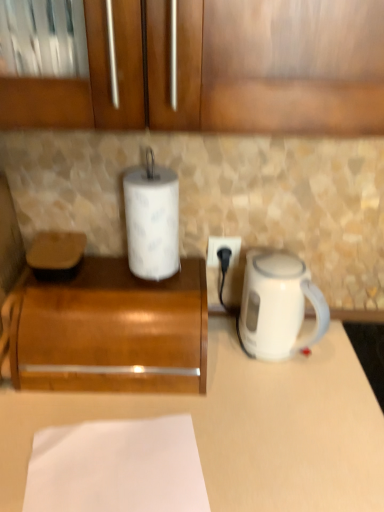
Question: Is white paper at lower center closer to the viewer compared to white matte counter at center?

Choices:
 (A) yes
 (B) no

Answer: (A)

Question: Does white paper at lower center have a lesser width compared to white matte counter at center?

Choices:
 (A) yes
 (B) no

Answer: (A)

Question: Is white paper at lower center located outside white matte counter at center?

Choices:
 (A) yes
 (B) no

Answer: (A)

Question: From a real-world perspective, is white paper at lower center below white matte counter at center?

Choices:
 (A) yes
 (B) no

Answer: (B)

Question: Is white paper at lower center shorter than white matte counter at center?

Choices:
 (A) no
 (B) yes

Answer: (B)

Question: From a real-world perspective, is white paper at center positioned above or below white paper at lower center?

Choices:
 (A) below
 (B) above

Answer: (B)

Question: In the image, is white paper at center positioned in front of or behind white paper at lower center?

Choices:
 (A) front
 (B) behind

Answer: (B)

Question: Is white paper at center taller or shorter than white paper at lower center?

Choices:
 (A) short
 (B) tall

Answer: (B)

Question: Is white paper at center bigger or smaller than white paper at lower center?

Choices:
 (A) small
 (B) big

Answer: (B)

Question: In terms of width, does white plastic power outlet at center look wider or thinner when compared to white matte counter at center?

Choices:
 (A) wide
 (B) thin

Answer: (B)

Question: From a real-world perspective, is white plastic power outlet at center above or below white matte counter at center?

Choices:
 (A) above
 (B) below

Answer: (A)

Question: Based on their positions, is white plastic power outlet at center located to the left or right of white matte counter at center?

Choices:
 (A) right
 (B) left

Answer: (B)

Question: Looking at the image, does white plastic power outlet at center seem bigger or smaller compared to white matte counter at center?

Choices:
 (A) big
 (B) small

Answer: (B)

Question: Is white glossy electric kettle at right in front of or behind white paper at center in the image?

Choices:
 (A) front
 (B) behind

Answer: (B)

Question: Visually, is white glossy electric kettle at right positioned to the left or to the right of white paper at center?

Choices:
 (A) right
 (B) left

Answer: (A)